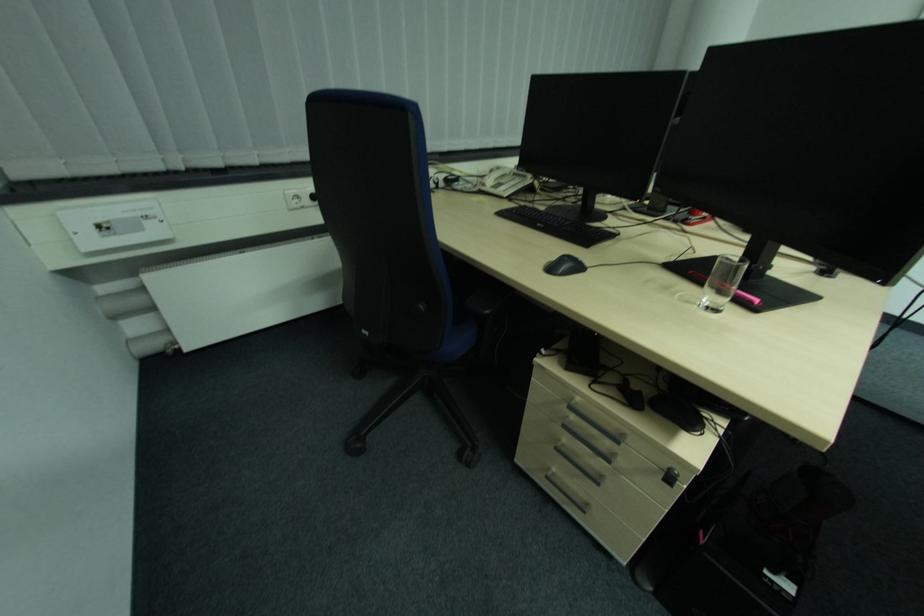
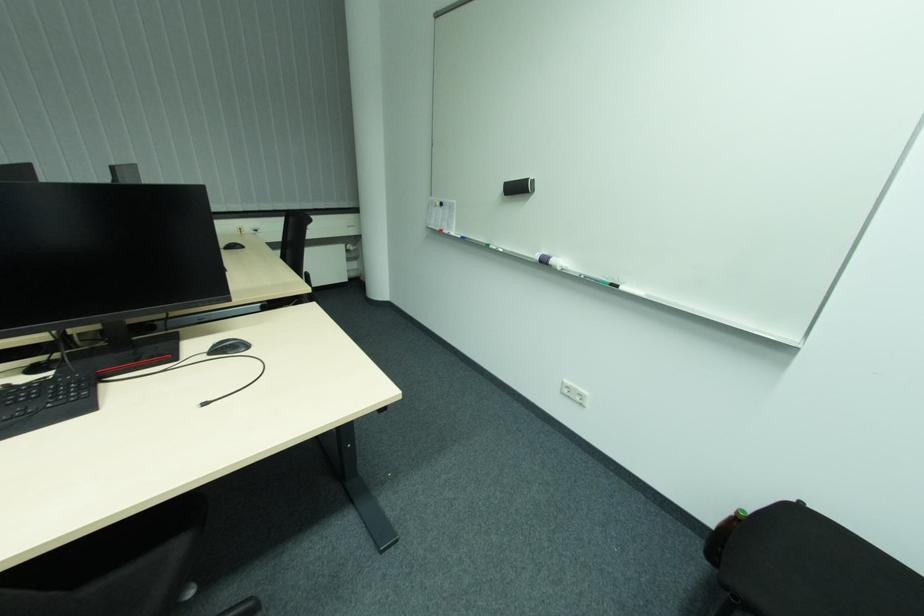
Question: What movement of the cameraman would produce the second image?

Choices:
 (A) Left
 (B) Right
 (C) Forward
 (D) Backward

Answer: (B)